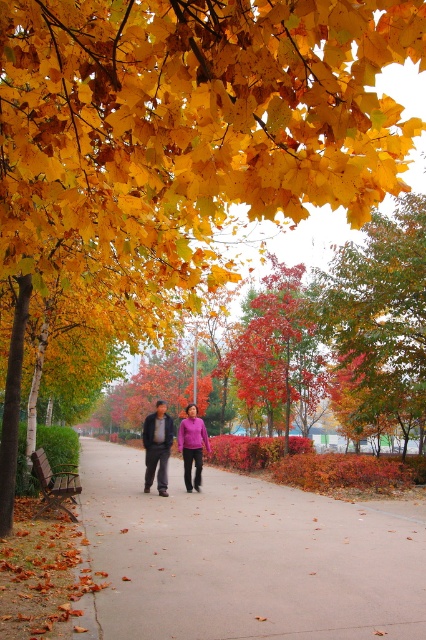
You are standing at the starting point of the pathway in the autumn park scene. You see two points marked on the path ahead of you. Which of the two points, point (x=244, y=324) or point (x=161, y=476), is closer to your current position?

Point (x=244, y=324) is closer to your current position because it is further to the viewer than point (x=161, y=476), meaning it is nearer to you.